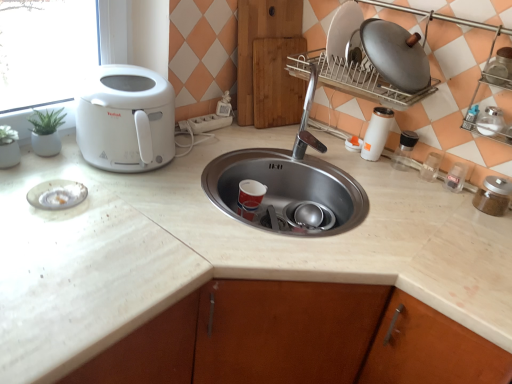
At what (x,y) coordinates should I click in order to perform the action: click on vacant space in front of transparent plastic container at right, the fourth appliance in the left-to-right sequence. Please return your answer as a coordinate pair (x, y). The height and width of the screenshot is (384, 512). Looking at the image, I should click on (424, 193).